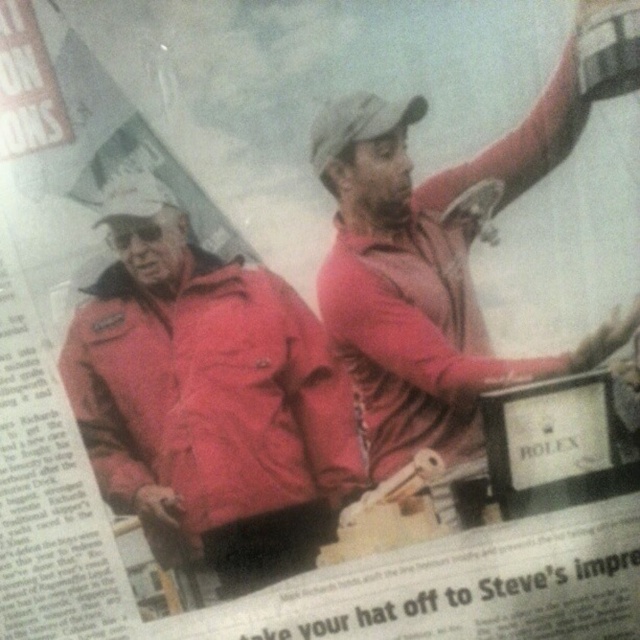
You are a fashion designer analyzing a photo for a new collection. You notice two red garments in the image. The first is a matte red jacket at center, and the second is a matte red shirt at upper right. Based on the photo, which of these garments appears to be larger in size?

The matte red shirt at upper right appears larger in size compared to the matte red jacket at center, as the jacket is described as having a smaller size than the shirt.

You are a photographer reviewing a printed image for a magazine layout. You notice two red items in the image. The first is a matte red jacket at center, and the second is a matte red shirt at upper right. Based on their positions, which one is closer to the bottom edge of the photo?

The matte red jacket at center is located below the matte red shirt at upper right, so the matte red jacket at center is closer to the bottom edge of the photo.

You are a photographer trying to capture a clear shot of both the matte red jacket at center and the matte red shirt at upper right. Which one will appear closer to the camera in the final photo?

The matte red jacket at center will appear closer to the camera because the matte red shirt at upper right is positioned behind it.